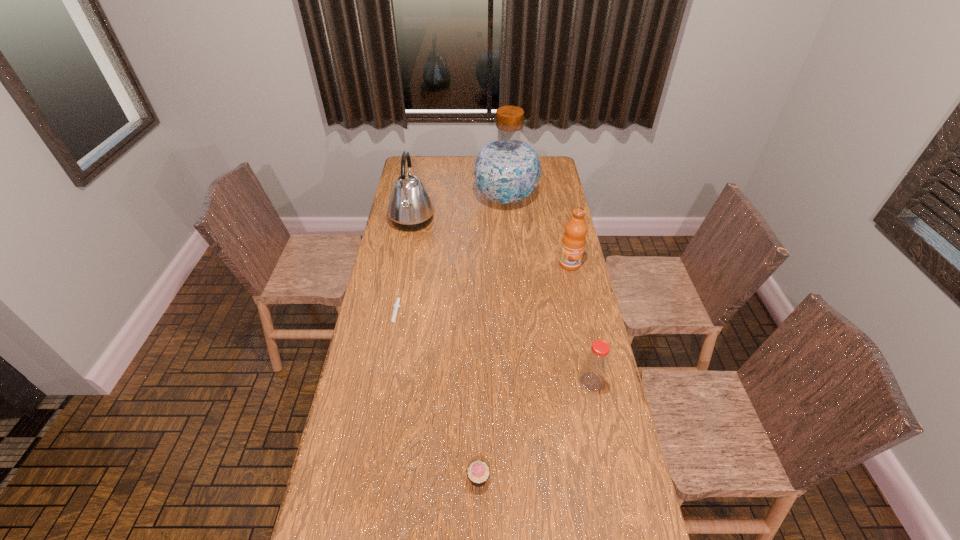
Locate an element on the screen. vacant area between the nearest object and the bottle is located at coordinates pos(535,430).

Identify the location of free spot between the fifth shortest object and the shortest object. The image size is (960, 540). [404, 268].

Locate an element on the screen. The width and height of the screenshot is (960, 540). free spot between the fruit juice and the second shortest object is located at coordinates (524, 371).

Locate an element on the screen. This screenshot has width=960, height=540. object that is the fifth nearest to the water jug is located at coordinates (478, 472).

Select which object is the third closest to the third nearest object. Please provide its 2D coordinates. Your answer should be formatted as a tuple, i.e. [(x, y)], where the tuple contains the x and y coordinates of a point satisfying the conditions above.

[(507, 170)]

The image size is (960, 540). Identify the location of vacant area that satisfies the following two spatial constraints: 1. from the spout of the kettle; 2. on the left side of the shortest object. (395, 315).

Identify the location of vacant space that satisfies the following two spatial constraints: 1. on the back side of the syringe; 2. from the spout of the second tallest object. The width and height of the screenshot is (960, 540). (413, 221).

This screenshot has width=960, height=540. Find the location of `free space that satisfies the following two spatial constraints: 1. on the front side of the cupcake; 2. on the left side of the shortest object`. free space that satisfies the following two spatial constraints: 1. on the front side of the cupcake; 2. on the left side of the shortest object is located at coordinates (366, 478).

You are a GUI agent. You are given a task and a screenshot of the screen. Output one action in this format:
    pyautogui.click(x=<x>, y=<y>)
    Task: Click on the vacant space that satisfies the following two spatial constraints: 1. on the front side of the syringe; 2. on the left side of the cupcake
    This screenshot has width=960, height=540.
    Given the screenshot: What is the action you would take?
    pyautogui.click(x=366, y=478)

Find the location of a particular element. The width and height of the screenshot is (960, 540). free space that satisfies the following two spatial constraints: 1. on the front side of the water jug; 2. on the left side of the bottle is located at coordinates (520, 382).